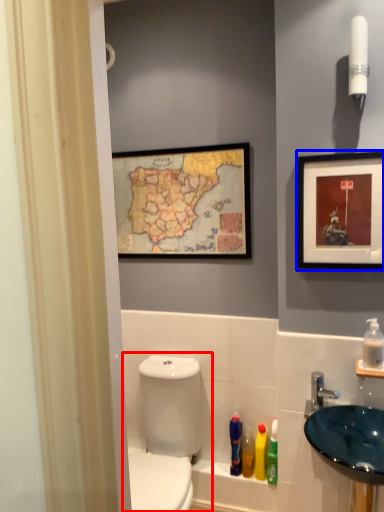
Question: Among these objects, which one is farthest to the camera, toilet (highlighted by a red box) or picture frame (highlighted by a blue box)?

Choices:
 (A) toilet
 (B) picture frame

Answer: (B)